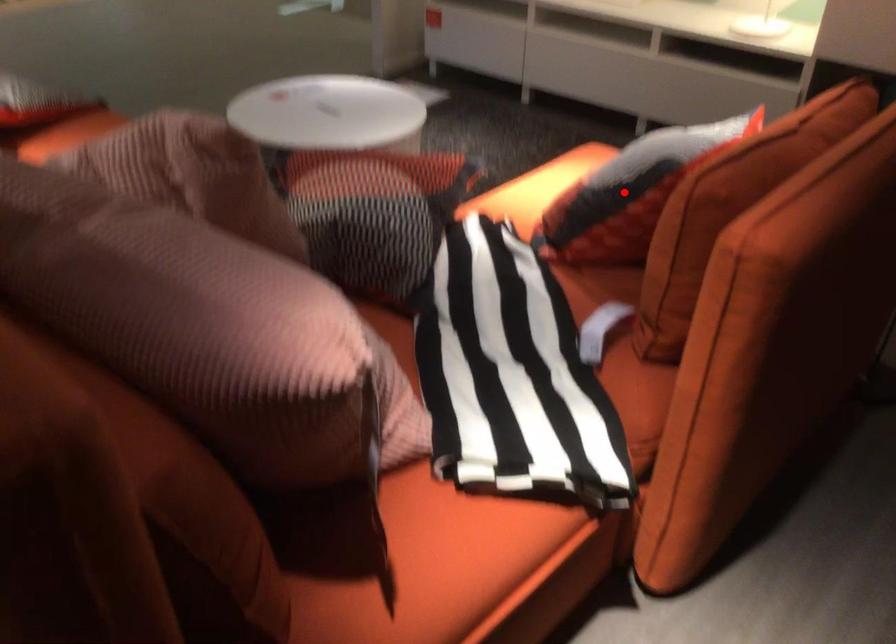
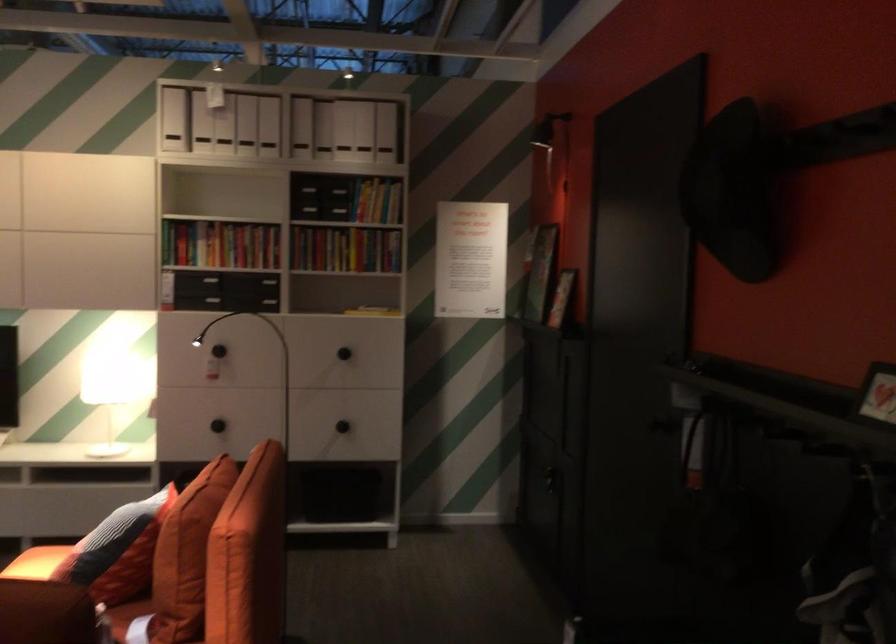
Locate, in the second image, the point that corresponds to the highlighted location in the first image.

(117, 551)